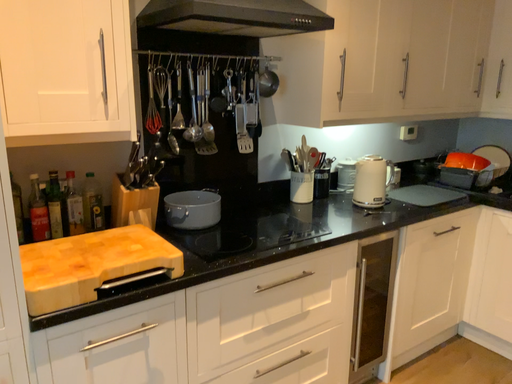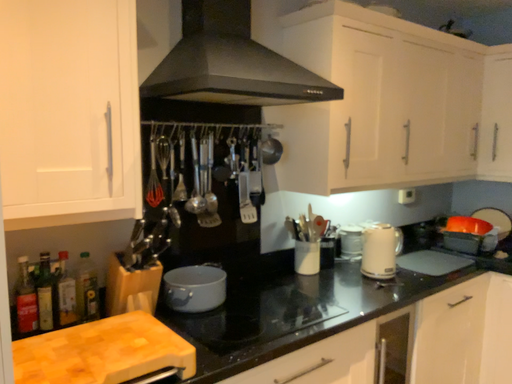
Question: How did the camera likely rotate when shooting the video?

Choices:
 (A) rotated upward
 (B) rotated downward

Answer: (A)